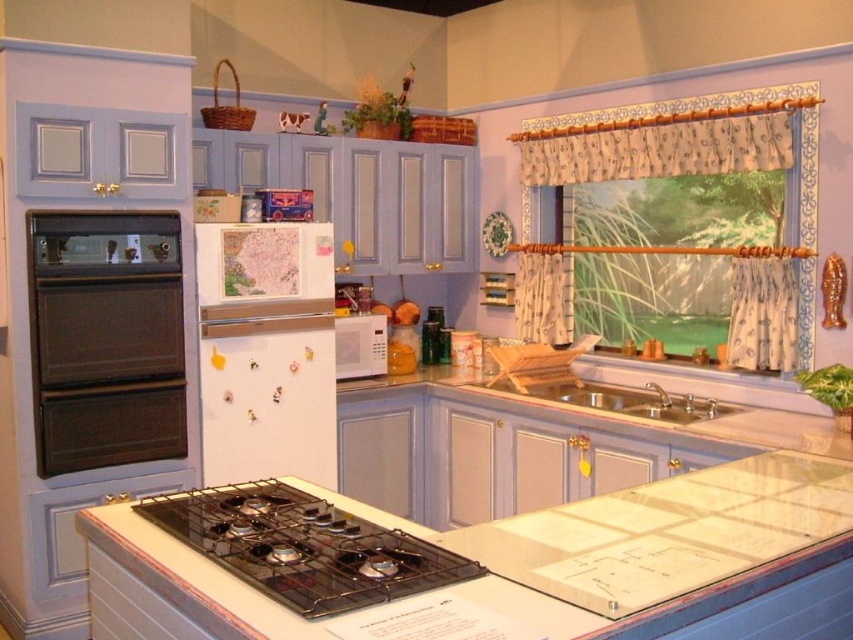
You are standing in the vintage kitchen and want to place a decorative item between the two points, point (137, 275) and point (221, 496). Which point is closer to you where you should start placing the item?

Point (137, 275) is closer to you than point (221, 496), so you should start placing the item near point (137, 275).

You are a chef preparing to wash dishes and need to locate the sink. In the vintage kitchen with lavender cabinets, where is the silver metallic sink at center relative to the white matte microwave at center?

The silver metallic sink at center is to the right of the white matte microwave at center.